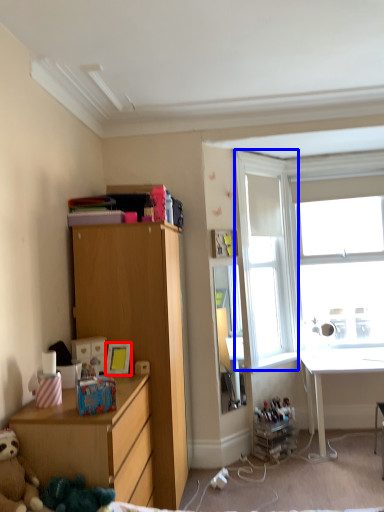
Question: Which point is further to the camera, picture frame (highlighted by a red box) or window screen (highlighted by a blue box)?

Choices:
 (A) picture frame
 (B) window screen

Answer: (B)